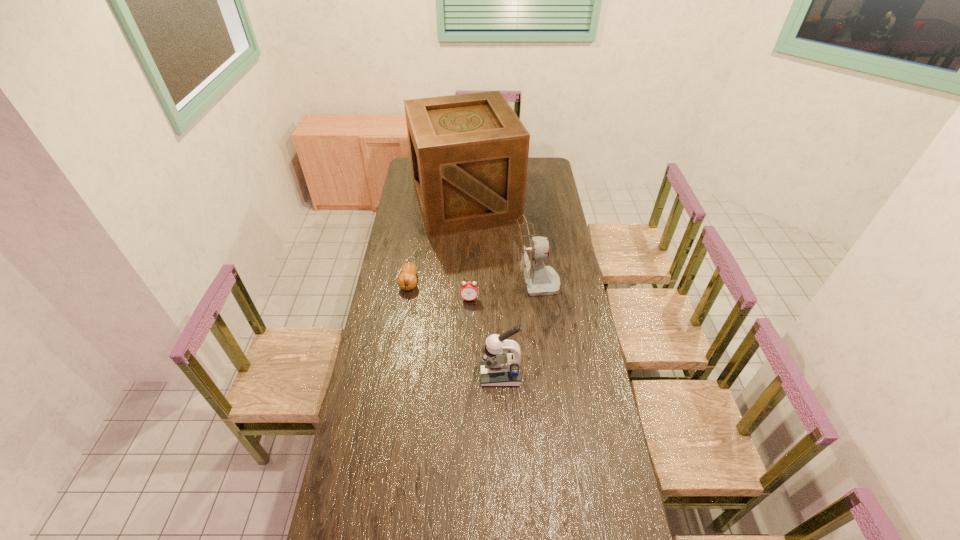
Locate an element on the screen. vacant space located 0.270m in front of the second tallest object to blow air is located at coordinates (454, 284).

Locate an element on the screen. vacant area situated on the back of the microscope is located at coordinates (499, 340).

This screenshot has width=960, height=540. What are the coordinates of `free space located 0.370m on the front-facing side of the alarm clock` in the screenshot? It's located at (468, 373).

Where is `vacant space located 0.230m on the stem side of the gourd`? Image resolution: width=960 pixels, height=540 pixels. vacant space located 0.230m on the stem side of the gourd is located at coordinates (400, 337).

In order to click on object present at the far edge in this screenshot , I will do `click(469, 152)`.

Locate an element on the screen. box that is at the left edge is located at coordinates (469, 152).

You are a GUI agent. You are given a task and a screenshot of the screen. Output one action in this format:
    pyautogui.click(x=<x>, y=<y>)
    Task: Click on the gourd at the left edge
    The image size is (960, 540).
    Given the screenshot: What is the action you would take?
    pyautogui.click(x=407, y=280)

Locate an element on the screen. Image resolution: width=960 pixels, height=540 pixels. object located in the right edge section of the desktop is located at coordinates (529, 251).

In order to click on object at the far left corner in this screenshot , I will do `click(469, 152)`.

You are a GUI agent. You are given a task and a screenshot of the screen. Output one action in this format:
    pyautogui.click(x=<x>, y=<y>)
    Task: Click on the vacant area at the left edge of the desktop
    This screenshot has height=540, width=960.
    Given the screenshot: What is the action you would take?
    pyautogui.click(x=402, y=381)